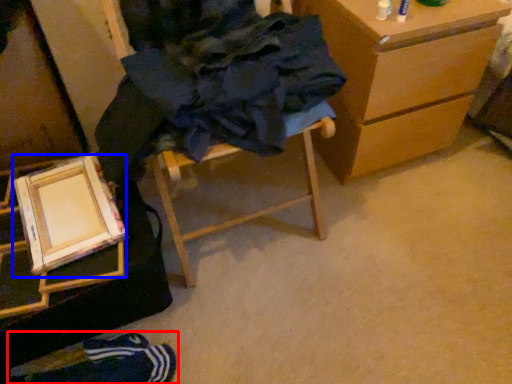
Question: Among these objects, which one is nearest to the camera, person (highlighted by a red box) or picture frame (highlighted by a blue box)?

Choices:
 (A) person
 (B) picture frame

Answer: (B)